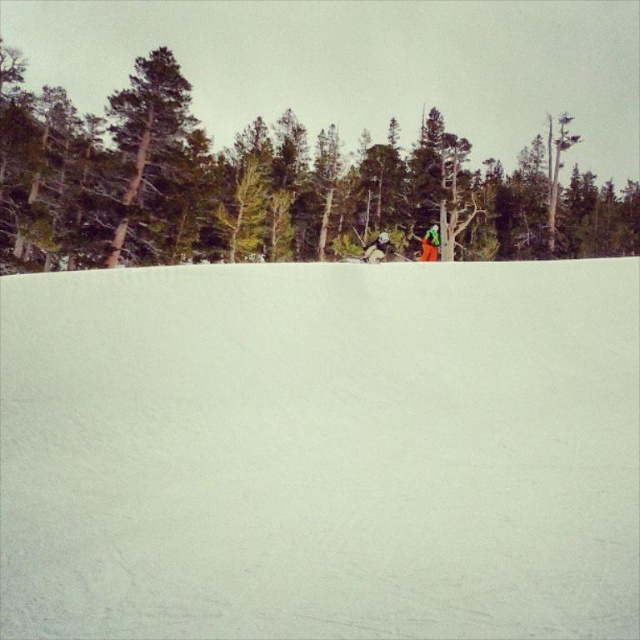
You are a photographer trying to capture a photo of the green fabric jacket at center and the white snow at center. Based on their positions, which object is closer to the camera?

The green fabric jacket at center is closer to the camera because it is above the white snow at center, which is positioned below it.

You are a skier standing at the bottom of the slope looking up. You want to reach the green matte tree at upper center. Which direction should you go relative to the white snow at center?

You should go to the right of the white snow at center to reach the green matte tree at upper center because the white snow at center is located to the left of the green matte tree at upper center.